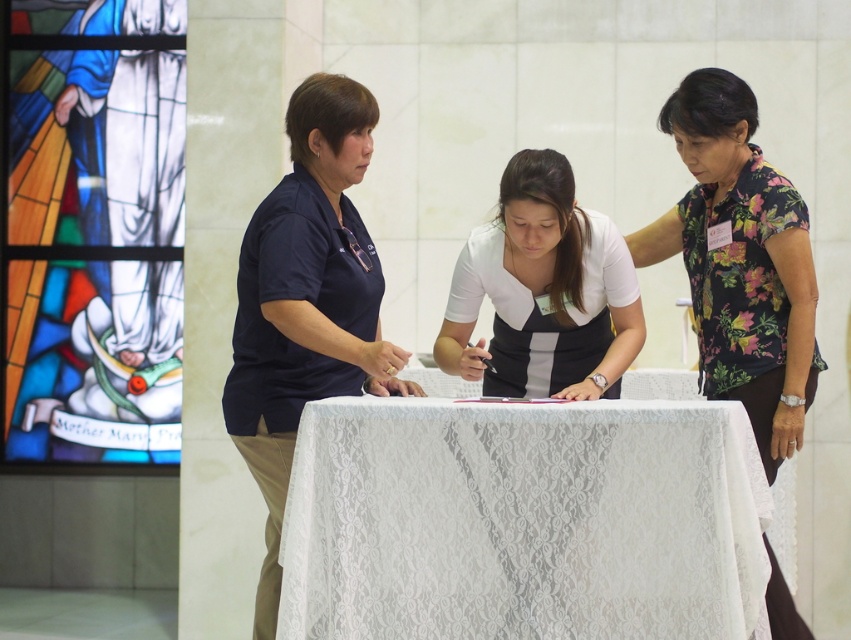
Is stained glass window at upper left wider than white matte shirt at center?

Yes.

Can you confirm if stained glass window at upper left is positioned to the left of white matte shirt at center?

Yes, stained glass window at upper left is to the left of white matte shirt at center.

This screenshot has height=640, width=851. Find the location of `stained glass window at upper left`. stained glass window at upper left is located at coordinates (94, 230).

Locate an element on the screen. The height and width of the screenshot is (640, 851). stained glass window at upper left is located at coordinates (94, 230).

Consider the image. Which is below, white lace tablecloth at center or dark blue shirt at center?

white lace tablecloth at center is lower down.

Is white lace tablecloth at center to the left of dark blue shirt at center from the viewer's perspective?

Incorrect, white lace tablecloth at center is not on the left side of dark blue shirt at center.

Is point (400, 467) more distant than point (323, 288)?

No, (400, 467) is in front of (323, 288).

This screenshot has height=640, width=851. I want to click on white lace tablecloth at center, so click(524, 522).

Can you confirm if white lace tablecloth at center is positioned above stained glass window at upper left?

No, white lace tablecloth at center is not above stained glass window at upper left.

Is white lace tablecloth at center closer to camera compared to stained glass window at upper left?

Yes, white lace tablecloth at center is closer to the viewer.

Is point (597, 500) positioned after point (146, 172)?

No.

You are a GUI agent. You are given a task and a screenshot of the screen. Output one action in this format:
    pyautogui.click(x=<x>, y=<y>)
    Task: Click on the white lace tablecloth at center
    
    Given the screenshot: What is the action you would take?
    pyautogui.click(x=524, y=522)